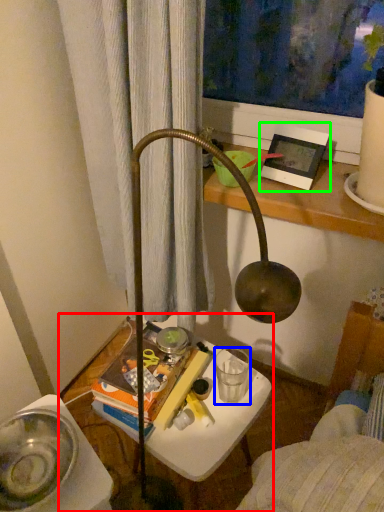
Question: Which object is positioned farthest from table (highlighted by a red box)? Select from beverage (highlighted by a blue box) and picture frame (highlighted by a green box).

Choices:
 (A) beverage
 (B) picture frame

Answer: (B)